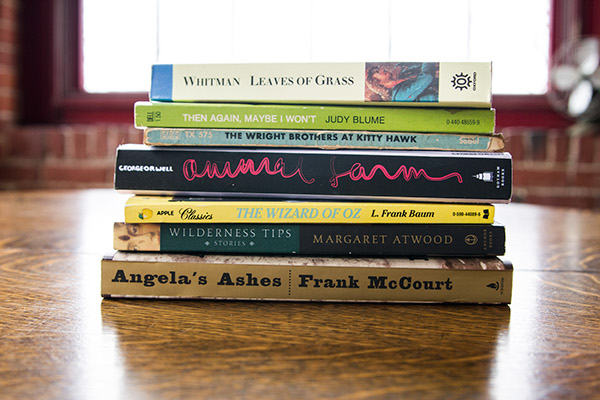
Where is `books`? books is located at coordinates (313, 278), (265, 229), (260, 213), (287, 175), (268, 139), (281, 119), (296, 90).